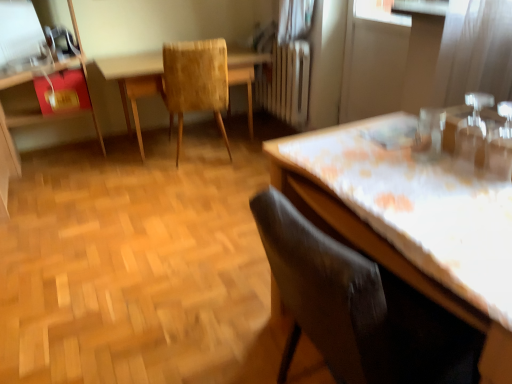
What is the approximate width of white floral tablecloth at right?

white floral tablecloth at right is 60.74 centimeters wide.

The width and height of the screenshot is (512, 384). Identify the location of transparent plastic screen door at upper right. (373, 61).

Describe the element at coordinates (196, 81) in the screenshot. This screenshot has width=512, height=384. I see `textured beige chair at center, which is counted as the first chair, starting from the back` at that location.

Image resolution: width=512 pixels, height=384 pixels. I want to click on velvet dark brown chair at lower right, positioned as the 2th chair in back-to-front order, so click(359, 308).

In the image, is textured beige chair at center, which is the 1th chair in left-to-right order, on the left side or the right side of matte red dresser at left?

From the image, it's evident that textured beige chair at center, which is the 1th chair in left-to-right order, is to the right of matte red dresser at left.

Find the location of a particular element. The width and height of the screenshot is (512, 384). chair behind the matte red dresser at left is located at coordinates (196, 81).

Is textured beige chair at center, acting as the first chair starting from the top, wider or thinner than matte red dresser at left?

Considering their sizes, textured beige chair at center, acting as the first chair starting from the top, looks slimmer than matte red dresser at left.

Which of these two, textured beige chair at center, which appears as the second chair when viewed from the right, or matte red dresser at left, is bigger?

matte red dresser at left is bigger.

How many degrees apart are the facing directions of white floral tablecloth at right and matte red dresser at left?

88.4 degrees separate the facing orientations of white floral tablecloth at right and matte red dresser at left.

Based on their positions, is white floral tablecloth at right located to the left or right of matte red dresser at left?

white floral tablecloth at right is positioned on matte red dresser at left's right side.

From the image's perspective, which one is positioned lower, white floral tablecloth at right or matte red dresser at left?

white floral tablecloth at right appears lower in the image.

Which of these two, transparent plastic window screen at upper left or velvet dark brown chair at lower right, acting as the 1th chair starting from the front, is thinner?

transparent plastic window screen at upper left is thinner.

Who is taller, transparent plastic window screen at upper left or velvet dark brown chair at lower right, positioned as the 2th chair in back-to-front order?

velvet dark brown chair at lower right, positioned as the 2th chair in back-to-front order.

Which is more to the right, transparent plastic window screen at upper left or velvet dark brown chair at lower right, the 1th chair when ordered from right to left?

velvet dark brown chair at lower right, the 1th chair when ordered from right to left.

Considering the sizes of objects transparent plastic window screen at upper left and velvet dark brown chair at lower right, the first chair from the bottom, in the image provided, who is smaller, transparent plastic window screen at upper left or velvet dark brown chair at lower right, the first chair from the bottom,?

transparent plastic window screen at upper left.

Where is `the 1st chair counting from the left of the white floral tablecloth at right`? The image size is (512, 384). the 1st chair counting from the left of the white floral tablecloth at right is located at coordinates tap(359, 308).

From the image's perspective, between white floral tablecloth at right and velvet dark brown chair at lower right, the 1th chair when ordered from right to left, who is located below?

velvet dark brown chair at lower right, the 1th chair when ordered from right to left, appears lower in the image.

Considering the relative sizes of white floral tablecloth at right and velvet dark brown chair at lower right, the 2th chair when ordered from left to right, in the image provided, is white floral tablecloth at right shorter than velvet dark brown chair at lower right, the 2th chair when ordered from left to right,?

Yes, white floral tablecloth at right is shorter than velvet dark brown chair at lower right, the 2th chair when ordered from left to right.

Considering the positions of point (366, 20) and point (447, 227), is point (366, 20) closer or farther from the camera than point (447, 227)?

Point (366, 20) appears to be farther away from the viewer than point (447, 227).

At what (x,y) coordinates should I click in order to perform the action: click on screen door that appears above the white floral tablecloth at right (from a real-world perspective). Please return your answer as a coordinate pair (x, y). This screenshot has height=384, width=512. Looking at the image, I should click on (373, 61).

Considering the relative sizes of transparent plastic screen door at upper right and white floral tablecloth at right in the image provided, is transparent plastic screen door at upper right bigger than white floral tablecloth at right?

No.

From a real-world perspective, between transparent plastic screen door at upper right and white floral tablecloth at right, who is vertically higher?

In real-world perspective, transparent plastic screen door at upper right is above.

Considering the relative sizes of transparent plastic screen door at upper right and transparent plastic window screen at upper left in the image provided, is transparent plastic screen door at upper right taller than transparent plastic window screen at upper left?

Yes, transparent plastic screen door at upper right is taller than transparent plastic window screen at upper left.

Is transparent plastic screen door at upper right wider or thinner than transparent plastic window screen at upper left?

In the image, transparent plastic screen door at upper right appears to be more narrow than transparent plastic window screen at upper left.

From a real-world perspective, who is located lower, transparent plastic screen door at upper right or transparent plastic window screen at upper left?

transparent plastic screen door at upper right is physically lower.

Is transparent plastic screen door at upper right aimed at transparent plastic window screen at upper left?

Yes, transparent plastic screen door at upper right is turned towards transparent plastic window screen at upper left.

From a real-world perspective, does transparent plastic screen door at upper right sit lower than matte red dresser at left?

Incorrect, from a real-world perspective, transparent plastic screen door at upper right is higher than matte red dresser at left.

This screenshot has height=384, width=512. Find the location of `screen door above the matte red dresser at left (from a real-world perspective)`. screen door above the matte red dresser at left (from a real-world perspective) is located at coordinates click(373, 61).

Is there a large distance between transparent plastic screen door at upper right and matte red dresser at left?

transparent plastic screen door at upper right is positioned a significant distance from matte red dresser at left.

Is transparent plastic screen door at upper right bigger or smaller than matte red dresser at left?

Result: Clearly, transparent plastic screen door at upper right is smaller in size than matte red dresser at left.

This screenshot has width=512, height=384. In the image, there is a textured beige chair at center, which is the 2th chair from front to back. In order to click on dresser below it (from the image's perspective) in this screenshot , I will do `click(40, 72)`.

Locate an element on the screen. counter top on the right of matte red dresser at left is located at coordinates (413, 208).

Estimate the real-world distances between objects in this image. Which object is further from wooden textured table at center, velvet dark brown chair at lower right, the first chair from the bottom, or matte red dresser at left?

velvet dark brown chair at lower right, the first chair from the bottom, is positioned further to the anchor wooden textured table at center.

Which object lies nearer to the anchor point white floral tablecloth at right, wooden textured table at center or textured beige chair at center, which is the 2th chair from front to back?

textured beige chair at center, which is the 2th chair from front to back.

Estimate the real-world distances between objects in this image. Which object is further from transparent plastic screen door at upper right, transparent plastic window screen at upper left or matte red dresser at left?

transparent plastic window screen at upper left is further to transparent plastic screen door at upper right.

Which object lies nearer to the anchor point wooden textured table at center, transparent plastic screen door at upper right or velvet dark brown chair at lower right, the 1th chair when ordered from right to left?

Among the two, transparent plastic screen door at upper right is located nearer to wooden textured table at center.

Which object lies further to the anchor point velvet dark brown chair at lower right, arranged as the 2th chair when viewed from the top, matte red dresser at left or white floral tablecloth at right?

Based on the image, matte red dresser at left appears to be further to velvet dark brown chair at lower right, arranged as the 2th chair when viewed from the top.

From the image, which object appears to be nearer to matte red dresser at left, textured beige chair at center, which appears as the second chair when viewed from the right, or wooden textured table at center?

wooden textured table at center is positioned closer to the anchor matte red dresser at left.

Estimate the real-world distances between objects in this image. Which object is closer to matte red dresser at left, velvet dark brown chair at lower right, the 1th chair when ordered from right to left, or textured beige chair at center, acting as the first chair starting from the top?

The object closer to matte red dresser at left is textured beige chair at center, acting as the first chair starting from the top.

Estimate the real-world distances between objects in this image. Which object is closer to transparent plastic window screen at upper left, matte red dresser at left or velvet dark brown chair at lower right, arranged as the 2th chair when viewed from the top?

matte red dresser at left lies closer to transparent plastic window screen at upper left than the other object.

Locate an element on the screen. The width and height of the screenshot is (512, 384). window screen between velvet dark brown chair at lower right, the 1th chair when ordered from right to left, and wooden textured table at center from front to back is located at coordinates (19, 30).

I want to click on table between transparent plastic window screen at upper left and transparent plastic screen door at upper right in the horizontal direction, so click(x=134, y=81).

Identify the location of dresser between transparent plastic window screen at upper left and wooden textured table at center. This screenshot has width=512, height=384. (40, 72).

I want to click on dresser positioned between velvet dark brown chair at lower right, the 2th chair when ordered from left to right, and textured beige chair at center, which is the 2th chair from front to back, from near to far, so click(x=40, y=72).